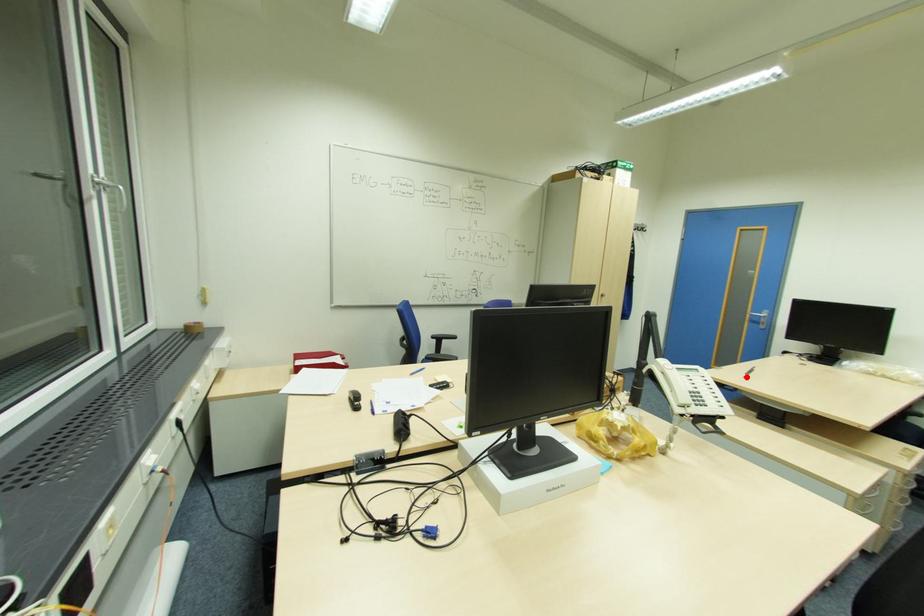
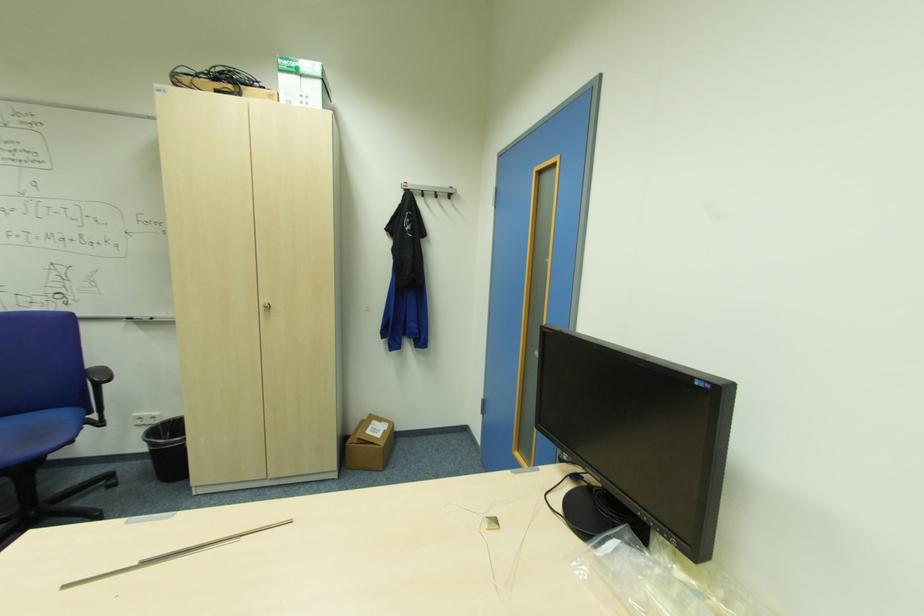
Question: I am providing you with two images of the same scene from different viewpoints. Image1 has a red point marked. In image2, the corresponding 3D location appears at what relative position? Reply with the corresponding letter.

Choices:
 (A) Closer
 (B) Farther

Answer: (A)